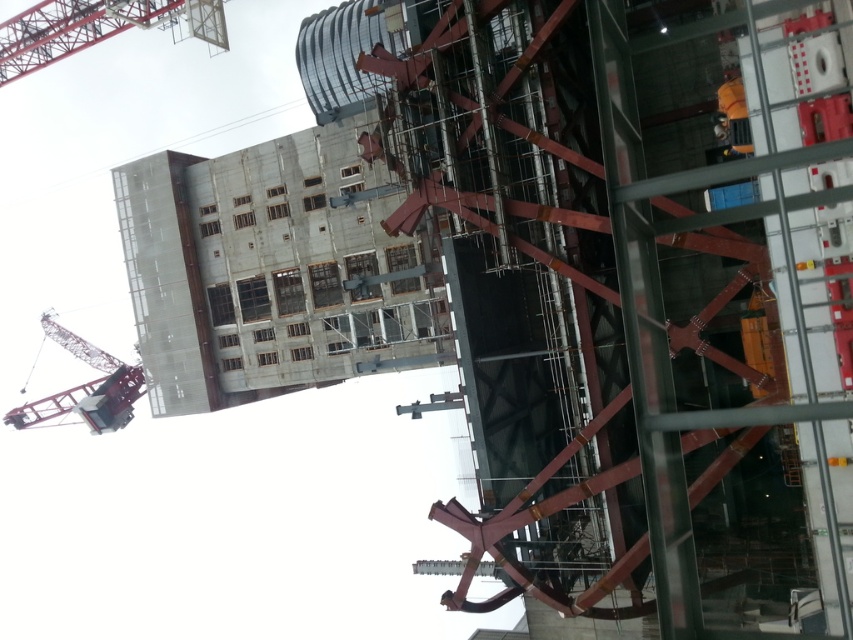
Question: Which point is closer to the camera taking this photo?

Choices:
 (A) (26, 45)
 (B) (303, 244)

Answer: (B)

Question: Does concrete/rough at center lie in front of metallic scaffolding at upper left?

Choices:
 (A) no
 (B) yes

Answer: (B)

Question: Based on their relative distances, which object is nearer to the concrete/rough at center?

Choices:
 (A) metallic gray crane at upper left
 (B) metallic scaffolding at upper left

Answer: (B)

Question: Which of the following is the closest to the observer?

Choices:
 (A) (161, 164)
 (B) (99, 369)
 (C) (160, 17)

Answer: (A)

Question: Where is concrete/rough at center located in relation to metallic scaffolding at upper left in the image?

Choices:
 (A) left
 (B) right

Answer: (B)

Question: Is concrete/rough at center thinner than metallic scaffolding at upper left?

Choices:
 (A) no
 (B) yes

Answer: (A)